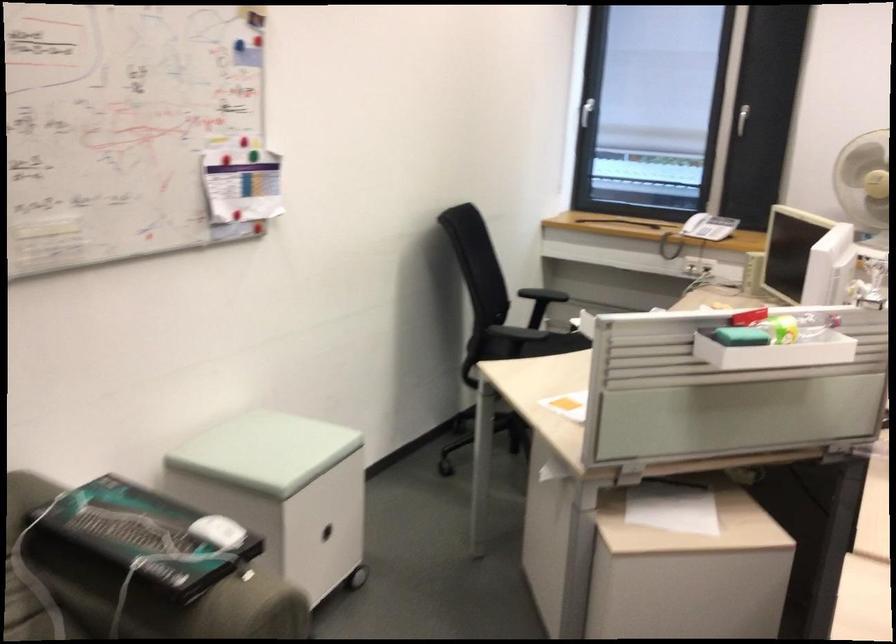
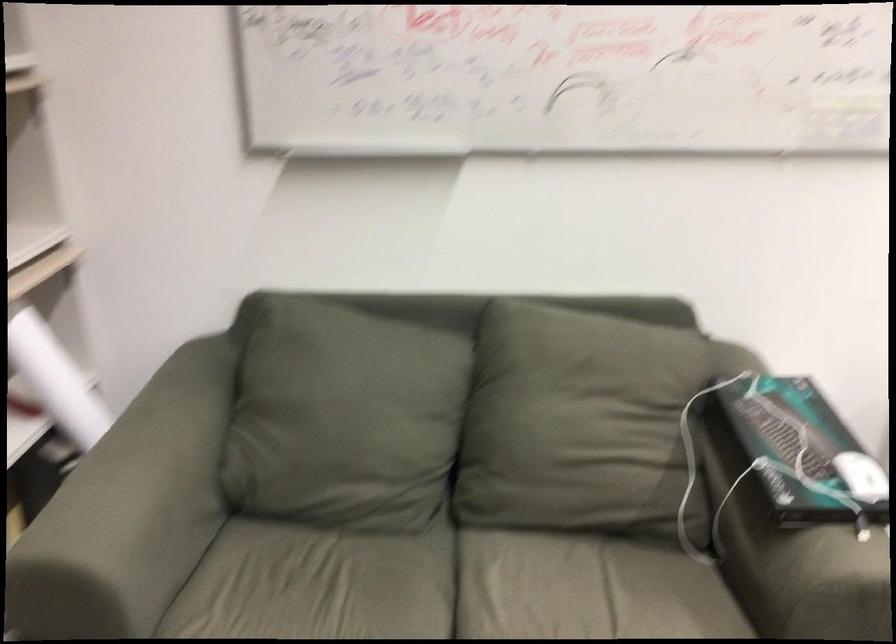
Question: Based on the continuous images, in which direction is the camera rotating? Reply with the corresponding letter.

Choices:
 (A) Left
 (B) Right
 (C) Up
 (D) Down

Answer: (A)